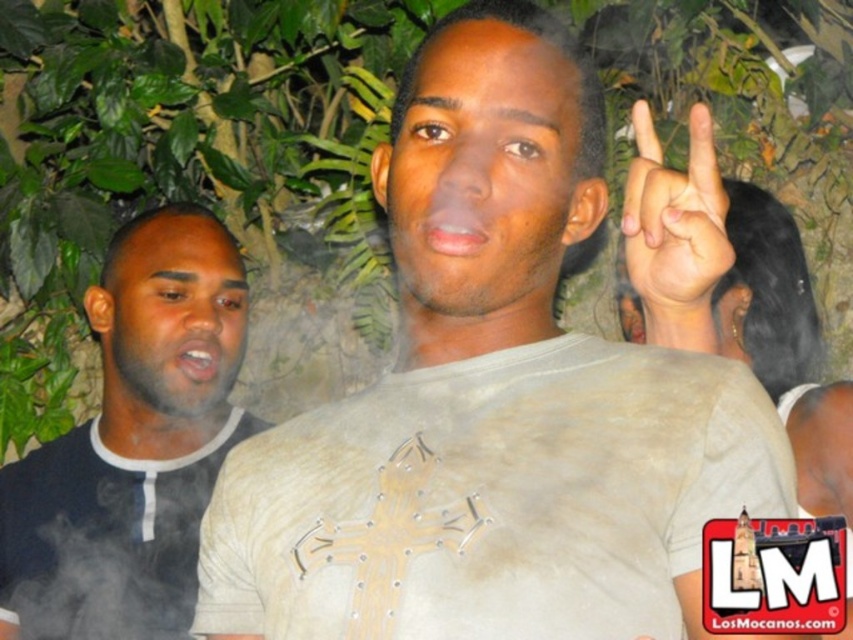
You are a photographer at a party. You want to capture a candid shot of the black matte shirt at left and the white matte hand at upper center. How far apart are these two elements in the scene?

The black matte shirt at left and the white matte hand at upper center are 37.46 inches apart.

You are at a party and want to approach the white matte shirt at center and the black matte shirt at left. Which person should you walk towards if you are currently standing to the left of both individuals?

You should walk towards the black matte shirt at left because it is closer to your current position on the left side of the scene.

You are at a party and see the black matte shirt at left and the white matte hand at upper center. Which object is taller?

The black matte shirt at left is much taller than the white matte hand at upper center.